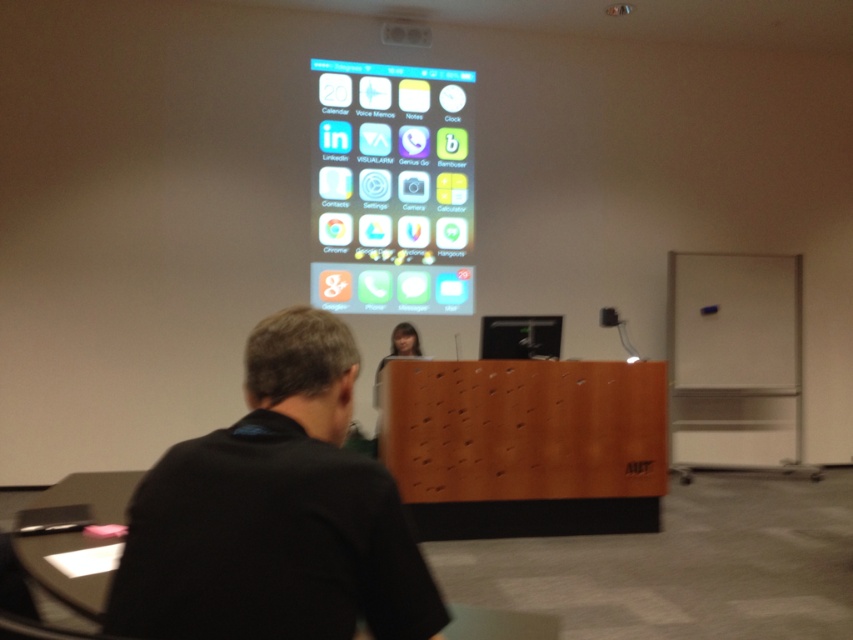
Which is below, black fabric shirt at center or black glossy computer screen at center?

black fabric shirt at center

Can you confirm if black fabric shirt at center is positioned above black glossy computer screen at center?

No, black fabric shirt at center is not above black glossy computer screen at center.

The image size is (853, 640). What are the coordinates of `black fabric shirt at center` in the screenshot? It's located at click(x=274, y=513).

Image resolution: width=853 pixels, height=640 pixels. I want to click on black fabric shirt at center, so click(x=274, y=513).

Does black fabric shirt at center have a greater width compared to matte glass phone at upper center?

No, black fabric shirt at center is not wider than matte glass phone at upper center.

Who is more forward, (380, 480) or (459, 182)?

Point (380, 480)

Which is in front, point (265, 531) or point (398, 76)?

Point (265, 531)

Locate an element on the screen. black fabric shirt at center is located at coordinates (274, 513).

Between point (349, 157) and point (512, 342), which one is positioned in front?

Point (512, 342) is in front.

How much distance is there between matte glass phone at upper center and black glossy computer screen at center?

2.14 meters

This screenshot has width=853, height=640. I want to click on matte glass phone at upper center, so click(x=392, y=188).